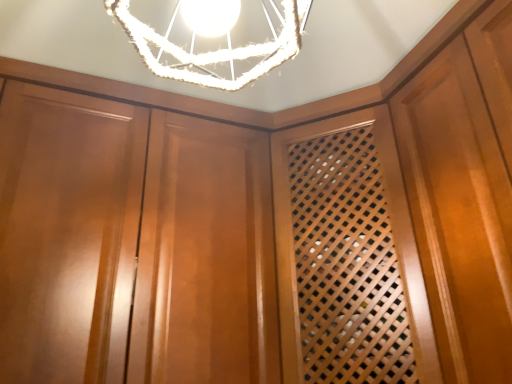
Question: Is point (175, 352) positioned closer to the camera than point (267, 21)?

Choices:
 (A) farther
 (B) closer

Answer: (B)

Question: Considering the positions of glossy wood cabinetry at center and white textured lampshade at upper center in the image, is glossy wood cabinetry at center wider or thinner than white textured lampshade at upper center?

Choices:
 (A) thin
 (B) wide

Answer: (B)

Question: From the image's perspective, is glossy wood cabinetry at center located above or below white textured lampshade at upper center?

Choices:
 (A) below
 (B) above

Answer: (A)

Question: Is white textured lampshade at upper center bigger or smaller than glossy wood cabinetry at center?

Choices:
 (A) big
 (B) small

Answer: (B)

Question: From a real-world perspective, is white textured lampshade at upper center positioned above or below glossy wood cabinetry at center?

Choices:
 (A) above
 (B) below

Answer: (A)

Question: From the image's perspective, relative to glossy wood cabinetry at center, is white textured lampshade at upper center above or below?

Choices:
 (A) below
 (B) above

Answer: (B)

Question: Would you say white textured lampshade at upper center is to the left or to the right of glossy wood cabinetry at center in the picture?

Choices:
 (A) left
 (B) right

Answer: (B)